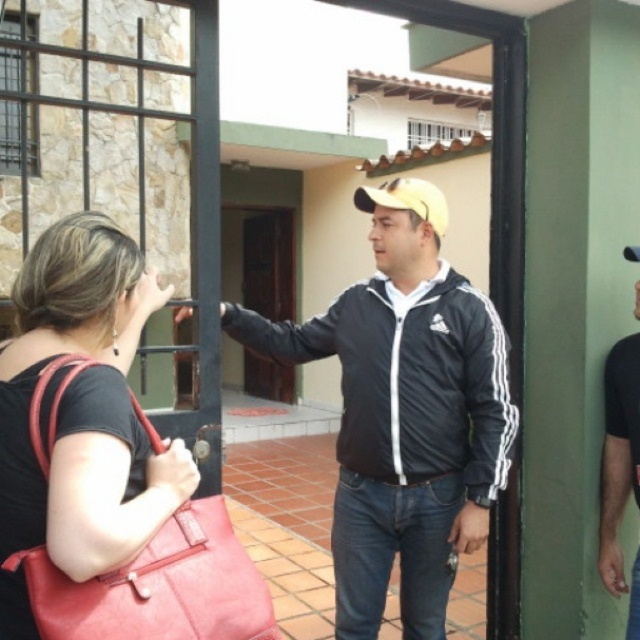
Is brown wooden door at center taller than yellow matte baseball hat at center?

Yes, brown wooden door at center is taller than yellow matte baseball hat at center.

Who is lower down, brown wooden door at center or yellow matte baseball hat at center?

yellow matte baseball hat at center

Measure the distance between point (257, 362) and camera.

The distance of point (257, 362) from camera is 9.57 meters.

The image size is (640, 640). In order to click on brown wooden door at center in this screenshot , I will do `click(268, 260)`.

How far apart are matte pink handbag at left and yellow matte baseball hat at center?

They are 1.18 meters apart.

Between matte pink handbag at left and yellow matte baseball hat at center, which one has less height?

With less height is yellow matte baseball hat at center.

Where is `matte pink handbag at left`? The image size is (640, 640). matte pink handbag at left is located at coordinates [x=81, y=413].

Can you confirm if matte pink handbag at left is taller than black matte jacket at right?

No.

This screenshot has width=640, height=640. Find the location of `matte pink handbag at left`. matte pink handbag at left is located at coordinates (81, 413).